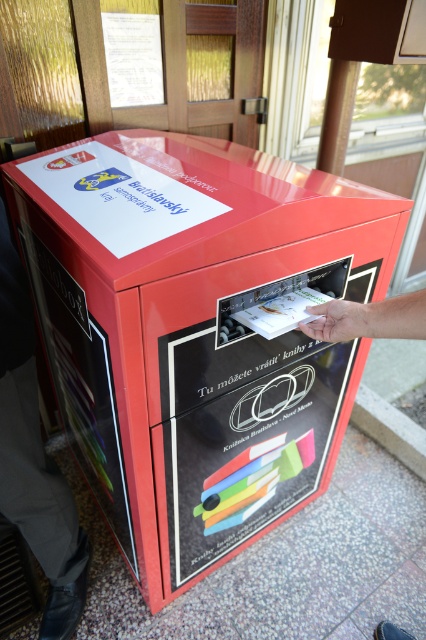
You are a person trying to return a book using the book drop box. You notice two hands in the image, a skinny hand at center and a white matte hand at center. Which hand should you follow to place your book in the correct spot?

You should follow the skinny hand at center because it is closer to you, indicating the proper placement area for returning books.

You are a person standing near the red book drop box and you want to place your gray fabric pants at lower left and skinny hand at center into the box. Which object is narrower so it can fit through the opening first?

The gray fabric pants at lower left is narrower than the skinny hand at center, so it can fit through the opening first.

In the scene shown: You are standing in front of the red book drop box and want to place a book into the slot. There are two points marked on the box. Which point is closer to you, point (x=158, y=483) or point (x=2, y=218)?

Point (x=2, y=218) is closer to you because the description states that point (x=158, y=483) is further to the camera than point (x=2, y=218).